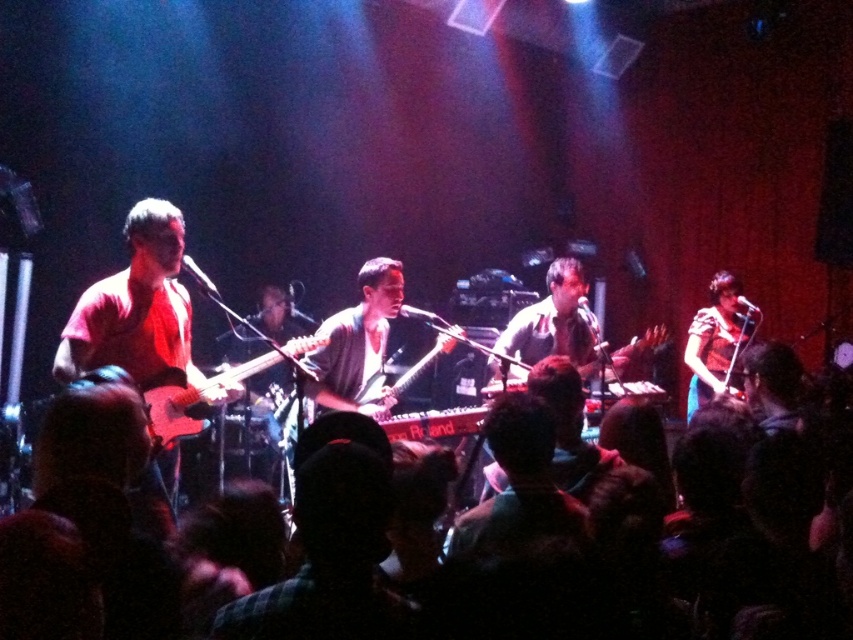
Question: In this image, where is matte blue dress at right located relative to matte white electric guitar at left?

Choices:
 (A) below
 (B) above

Answer: (B)

Question: Which of the following is the closest to the observer?

Choices:
 (A) matte blue dress at right
 (B) black fabric crowd at lower center
 (C) matte white electric guitar at left

Answer: (B)

Question: Does matte blue dress at right appear on the left side of matte white electric guitar at left?

Choices:
 (A) no
 (B) yes

Answer: (A)

Question: Can you confirm if black fabric crowd at lower center is bigger than shiny silver electric guitar at center?

Choices:
 (A) yes
 (B) no

Answer: (A)

Question: Estimate the real-world distances between objects in this image. Which object is farther from the matte white electric guitar at left?

Choices:
 (A) black fabric crowd at lower center
 (B) shiny silver electric guitar at center
 (C) matte blue dress at right

Answer: (C)

Question: Which of the following is the closest to the observer?

Choices:
 (A) (709, 289)
 (B) (173, 406)
 (C) (357, 408)
 (D) (757, 566)

Answer: (D)